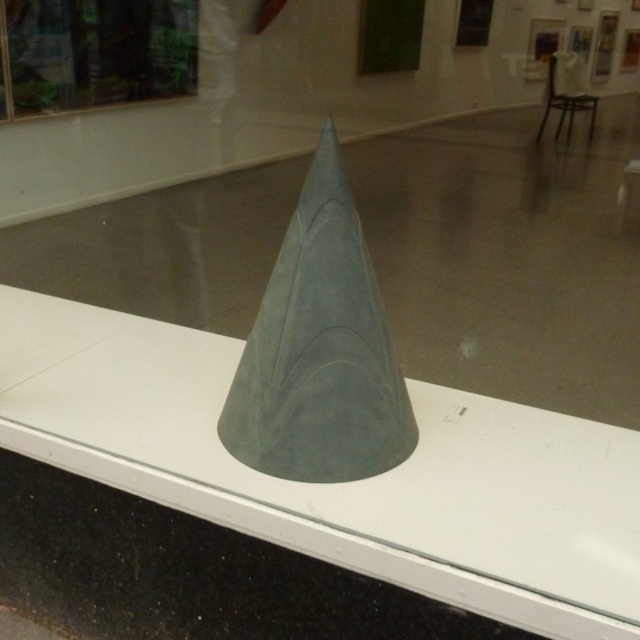
Question: Which point appears closest to the camera in this image?

Choices:
 (A) (356, 458)
 (B) (184, 340)

Answer: (A)

Question: Considering the relative positions of transparent glass cone at center and suede gray cone at center in the image provided, where is transparent glass cone at center located with respect to suede gray cone at center?

Choices:
 (A) below
 (B) above

Answer: (A)

Question: Is transparent glass cone at center above suede gray cone at center?

Choices:
 (A) yes
 (B) no

Answer: (B)

Question: Does transparent glass cone at center appear on the right side of suede gray cone at center?

Choices:
 (A) yes
 (B) no

Answer: (B)

Question: Which of the following is the farthest from the observer?

Choices:
 (A) transparent glass cone at center
 (B) suede gray cone at center

Answer: (B)

Question: Which point is farther to the camera?

Choices:
 (A) transparent glass cone at center
 (B) suede gray cone at center

Answer: (B)